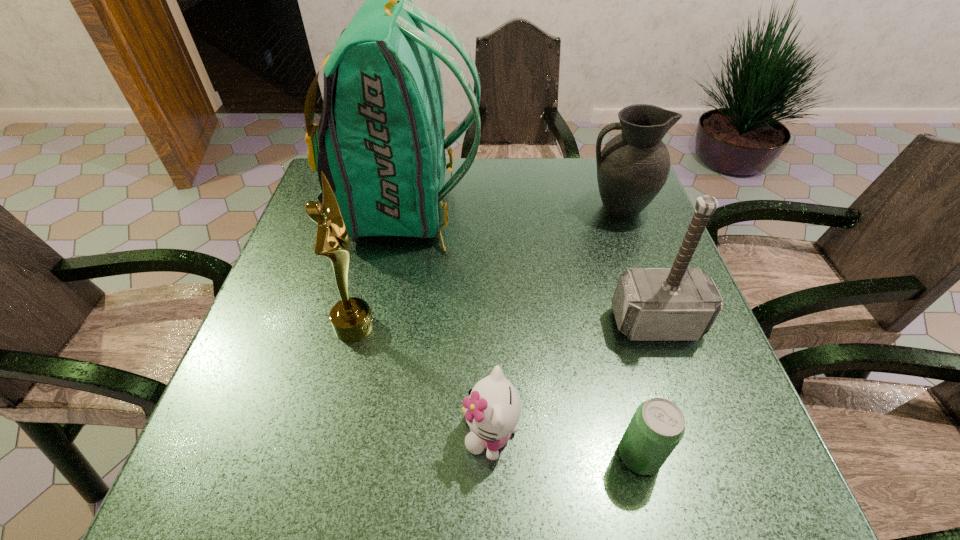
The image size is (960, 540). Identify the location of vacant space located on the side of the third shortest object with the handle. (531, 208).

Identify the location of vacant point located on the side of the third shortest object with the handle. Image resolution: width=960 pixels, height=540 pixels. (471, 208).

The image size is (960, 540). I want to click on free spot located 0.160m on the front-facing side of the kitten, so click(x=370, y=432).

Locate an element on the screen. The height and width of the screenshot is (540, 960). vacant space located 0.160m on the front-facing side of the kitten is located at coordinates (370, 432).

Image resolution: width=960 pixels, height=540 pixels. I want to click on vacant space located 0.350m on the front-facing side of the kitten, so click(x=258, y=432).

Identify the location of free space located 0.360m on the back of the soda. This screenshot has width=960, height=540. (596, 281).

Find the location of `backpack positioned at the far edge`. backpack positioned at the far edge is located at coordinates (380, 142).

The width and height of the screenshot is (960, 540). I want to click on pitcher that is at the far edge, so click(x=632, y=168).

Find the location of a particular element. This screenshot has width=960, height=540. kitten that is positioned at the near edge is located at coordinates (492, 409).

Locate an element on the screen. The width and height of the screenshot is (960, 540). soda that is at the near edge is located at coordinates (658, 425).